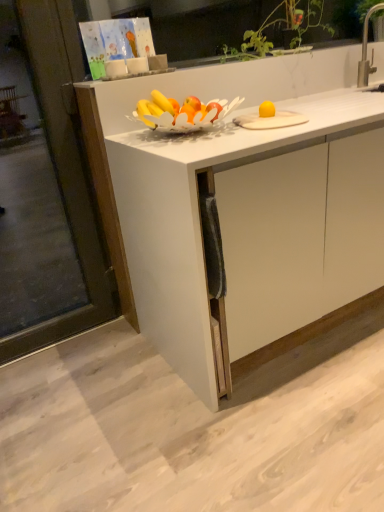
What do you see at coordinates (253, 227) in the screenshot?
I see `white matte cabinet at center` at bounding box center [253, 227].

Measure the distance between silver metallic faucet at upper right and camera.

The depth of silver metallic faucet at upper right is 2.07 meters.

You are a GUI agent. You are given a task and a screenshot of the screen. Output one action in this format:
    pyautogui.click(x=<x>, y=<y>)
    Task: Click on the transparent glass screen door at left
    Image resolution: width=384 pixels, height=512 pixels.
    Given the screenshot: What is the action you would take?
    pyautogui.click(x=64, y=174)

Is white matte cabinet at center in front of or behind transparent glass screen door at left in the image?

white matte cabinet at center is in front of transparent glass screen door at left.

Who is smaller, white matte cabinet at center or transparent glass screen door at left?

Smaller between the two is transparent glass screen door at left.

From a real-world perspective, relative to transparent glass screen door at left, is white matte cabinet at center vertically above or below?

white matte cabinet at center is situated lower than transparent glass screen door at left in the real world.

Is white matte cabinet at center positioned with its back to transparent glass screen door at left?

No, white matte cabinet at center is not facing away from transparent glass screen door at left.

Is transparent glass screen door at left turned away from silver metallic faucet at upper right?

That's not correct — transparent glass screen door at left is not looking away from silver metallic faucet at upper right.

Locate an element on the screen. This screenshot has height=512, width=384. faucet that is on the right side of transparent glass screen door at left is located at coordinates (366, 50).

Which of these two, transparent glass screen door at left or silver metallic faucet at upper right, stands shorter?

silver metallic faucet at upper right.

Between transparent glass screen door at left and silver metallic faucet at upper right, which one has larger size?

Bigger between the two is transparent glass screen door at left.

From the image's perspective, is white matte cabinet at center located above or below silver metallic faucet at upper right?

Clearly, from the image's perspective, white matte cabinet at center is below silver metallic faucet at upper right.

Looking at their sizes, would you say white matte cabinet at center is wider or thinner than silver metallic faucet at upper right?

white matte cabinet at center is wider than silver metallic faucet at upper right.

Considering the points (134, 154) and (360, 77), which point is behind, point (134, 154) or point (360, 77)?

Positioned behind is point (360, 77).

From a real-world perspective, who is located higher, white matte cabinet at center or silver metallic faucet at upper right?

silver metallic faucet at upper right is physically above.

Considering the relative positions of silver metallic faucet at upper right and white matte cabinet at center in the image provided, is silver metallic faucet at upper right in front of white matte cabinet at center?

No, silver metallic faucet at upper right is further to the viewer.

Is silver metallic faucet at upper right not within white matte cabinet at center?

Yes, silver metallic faucet at upper right is outside of white matte cabinet at center.

Between silver metallic faucet at upper right and white matte cabinet at center, which one has larger width?

white matte cabinet at center is wider.

Is silver metallic faucet at upper right far away from white matte cabinet at center?

Yes, silver metallic faucet at upper right and white matte cabinet at center are located far from each other.

Is silver metallic faucet at upper right far from transparent glass screen door at left?

Indeed, silver metallic faucet at upper right is not near transparent glass screen door at left.

From a real-world perspective, is silver metallic faucet at upper right located beneath transparent glass screen door at left?

Incorrect, from a real-world perspective, silver metallic faucet at upper right is higher than transparent glass screen door at left.

Looking at this image, is transparent glass screen door at left inside silver metallic faucet at upper right?

No, transparent glass screen door at left is not a part of silver metallic faucet at upper right.

Is transparent glass screen door at left at the left side of white matte cabinet at center?

Correct, you'll find transparent glass screen door at left to the left of white matte cabinet at center.

Is point (102, 245) more distant than point (263, 245)?

Yes.

Is transparent glass screen door at left facing away from white matte cabinet at center?

No.

The width and height of the screenshot is (384, 512). I want to click on cabinetry in front of the transparent glass screen door at left, so click(253, 227).

Identify the location of faucet to the right of transparent glass screen door at left. (366, 50).

From the image, which object appears to be nearer to transparent glass screen door at left, white matte cabinet at center or silver metallic faucet at upper right?

The object closer to transparent glass screen door at left is white matte cabinet at center.

Estimate the real-world distances between objects in this image. Which object is closer to white matte cabinet at center, transparent glass screen door at left or silver metallic faucet at upper right?

transparent glass screen door at left.

Which object lies nearer to the anchor point transparent glass screen door at left, silver metallic faucet at upper right or white matte cabinet at center?

white matte cabinet at center.

Which object lies nearer to the anchor point white matte cabinet at center, silver metallic faucet at upper right or transparent glass screen door at left?

transparent glass screen door at left lies closer to white matte cabinet at center than the other object.

In the scene shown: Estimate the real-world distances between objects in this image. Which object is closer to silver metallic faucet at upper right, transparent glass screen door at left or white matte cabinet at center?

white matte cabinet at center is closer to silver metallic faucet at upper right.

Based on their spatial positions, is white matte cabinet at center or transparent glass screen door at left further from silver metallic faucet at upper right?

Among the two, transparent glass screen door at left is located further to silver metallic faucet at upper right.

At what (x,y) coordinates should I click in order to perform the action: click on cabinetry between transparent glass screen door at left and silver metallic faucet at upper right. Please return your answer as a coordinate pair (x, y). The width and height of the screenshot is (384, 512). Looking at the image, I should click on (253, 227).